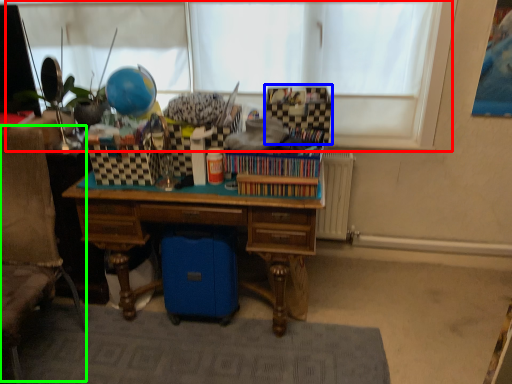
Question: Estimate the real-world distances between objects in this image. Which object is farther from window screen (highlighted by a red box), storage box (highlighted by a blue box) or swivel chair (highlighted by a green box)?

Choices:
 (A) storage box
 (B) swivel chair

Answer: (B)